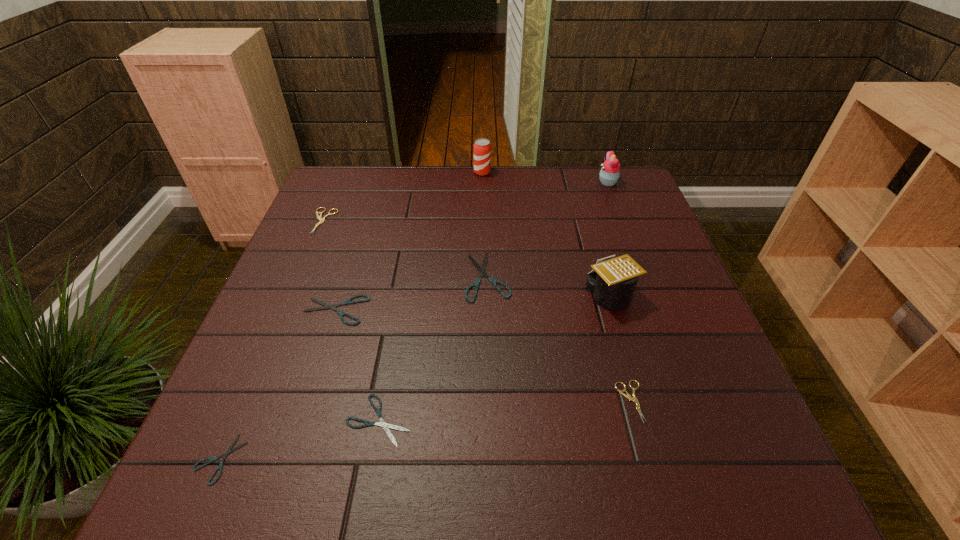
Find the location of a particular element. orange beer can is located at coordinates (482, 148).

The height and width of the screenshot is (540, 960). Identify the location of the rightmost object. pos(610,172).

Find the location of a particular element. The image size is (960, 540). calculator is located at coordinates (612, 282).

Find the location of a particular element. The image size is (960, 540). the biggest black shears is located at coordinates (482, 269).

Locate an element on the screen. Image resolution: width=960 pixels, height=540 pixels. the rightmost black shears is located at coordinates (482, 269).

The image size is (960, 540). I want to click on the seventh nearest object, so click(x=321, y=220).

This screenshot has height=540, width=960. Find the location of `the farther beige shears`. the farther beige shears is located at coordinates (321, 220).

Find the location of a particular element. the second biggest black shears is located at coordinates (347, 302).

The image size is (960, 540). What are the coordinates of `the third shears from left to right` in the screenshot? It's located at (347, 302).

The image size is (960, 540). I want to click on the rightmost shears, so click(628, 396).